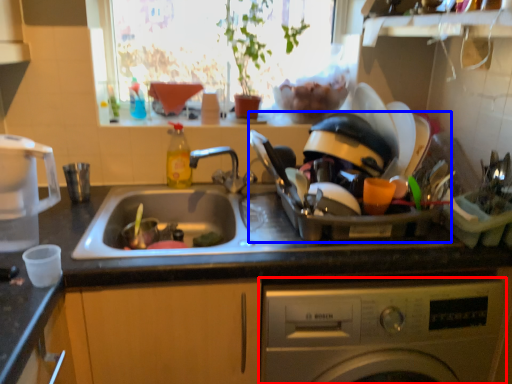
Question: Which point is closer to the camera, washing machine (highlighted by a red box) or appliance (highlighted by a blue box)?

Choices:
 (A) washing machine
 (B) appliance

Answer: (A)